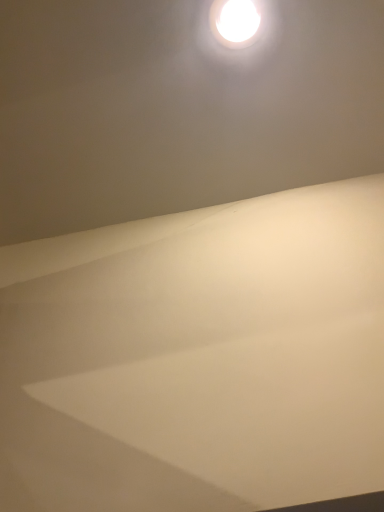
What do you see at coordinates (234, 22) in the screenshot? Image resolution: width=384 pixels, height=512 pixels. I see `white glossy light fixture at upper center` at bounding box center [234, 22].

At what (x,y) coordinates should I click in order to perform the action: click on white glossy light fixture at upper center. Please return your answer as a coordinate pair (x, y). Looking at the image, I should click on (234, 22).

In order to face white glossy light fixture at upper center, should I rotate leftwards or rightwards?

You should rotate right by 5.495 degrees.

You are a GUI agent. You are given a task and a screenshot of the screen. Output one action in this format:
    pyautogui.click(x=<x>, y=<y>)
    Task: Click on the white glossy light fixture at upper center
    This screenshot has width=384, height=512.
    Given the screenshot: What is the action you would take?
    pyautogui.click(x=234, y=22)